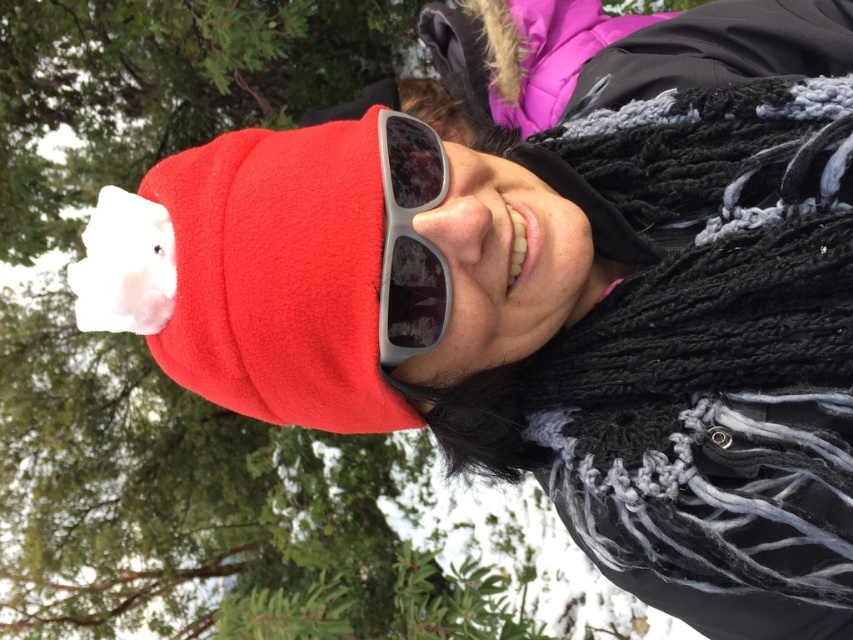
Question: Is black knitted scarf at right wider than gray matte sunglasses at center?

Choices:
 (A) yes
 (B) no

Answer: (A)

Question: Which point is farther to the camera?

Choices:
 (A) gray matte sunglasses at center
 (B) black knitted scarf at right

Answer: (A)

Question: Is black knitted scarf at right below gray matte sunglasses at center?

Choices:
 (A) yes
 (B) no

Answer: (A)

Question: Does black knitted scarf at right appear on the right side of gray matte sunglasses at center?

Choices:
 (A) yes
 (B) no

Answer: (A)